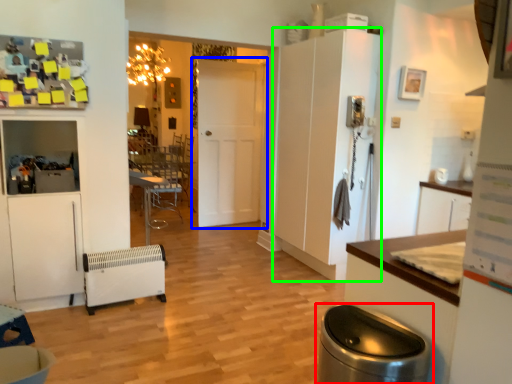
Question: Based on their relative distances, which object is nearer to waste container (highlighted by a red box)? Choose from door (highlighted by a blue box) and cabinetry (highlighted by a green box).

Choices:
 (A) door
 (B) cabinetry

Answer: (B)